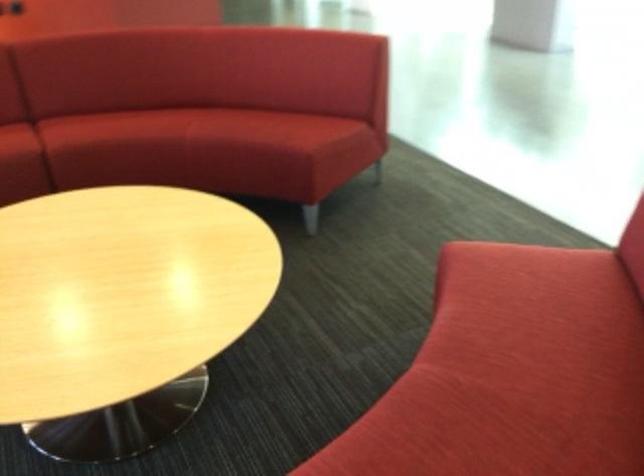
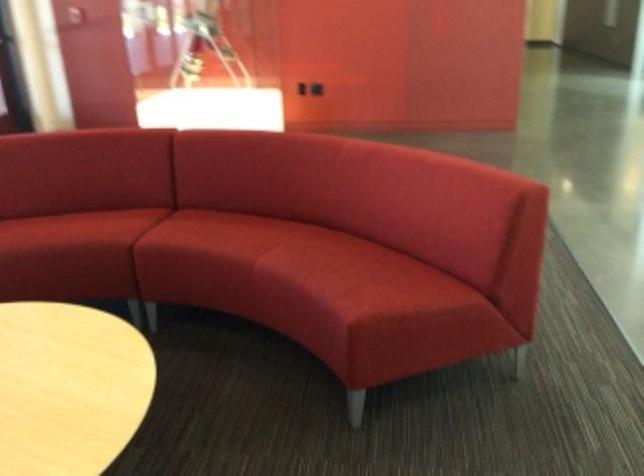
Locate, in the second image, the point that corresponds to pixel 243 124 in the first image.

(328, 258)